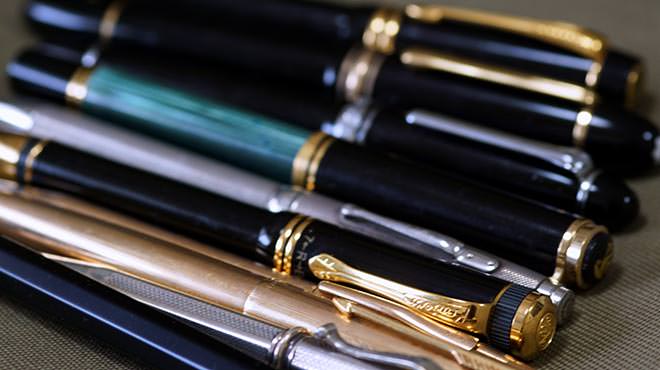
Locate an element on the screen. number of pens is located at coordinates (593, 65), (546, 109), (515, 163), (464, 204), (430, 247), (411, 273), (346, 327), (248, 342).